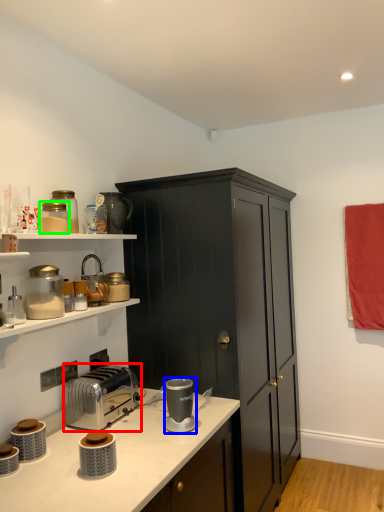
Question: Based on their relative distances, which object is nearer to toaster (highlighted by a red box)? Choose from appliance (highlighted by a blue box) and appliance (highlighted by a green box).

Choices:
 (A) appliance
 (B) appliance

Answer: (A)